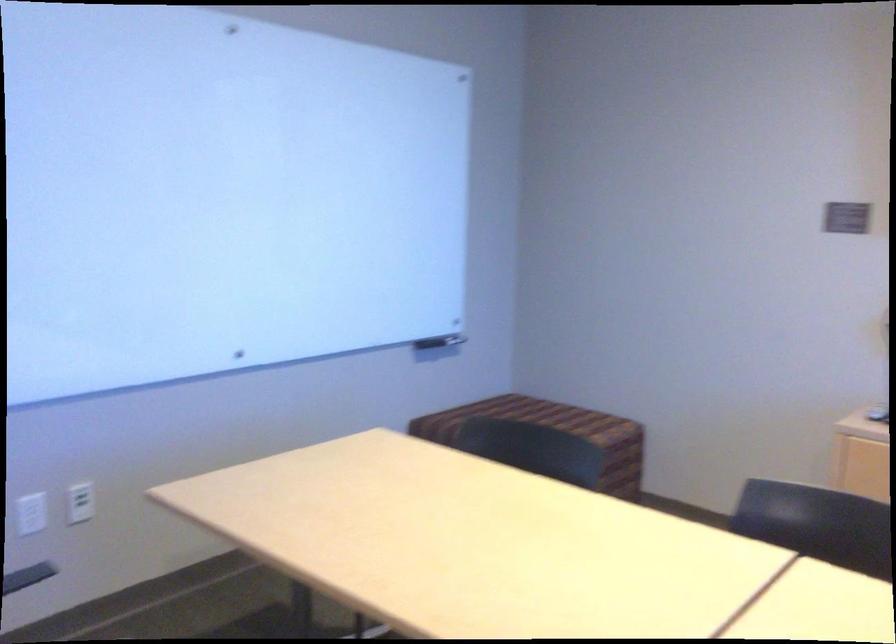
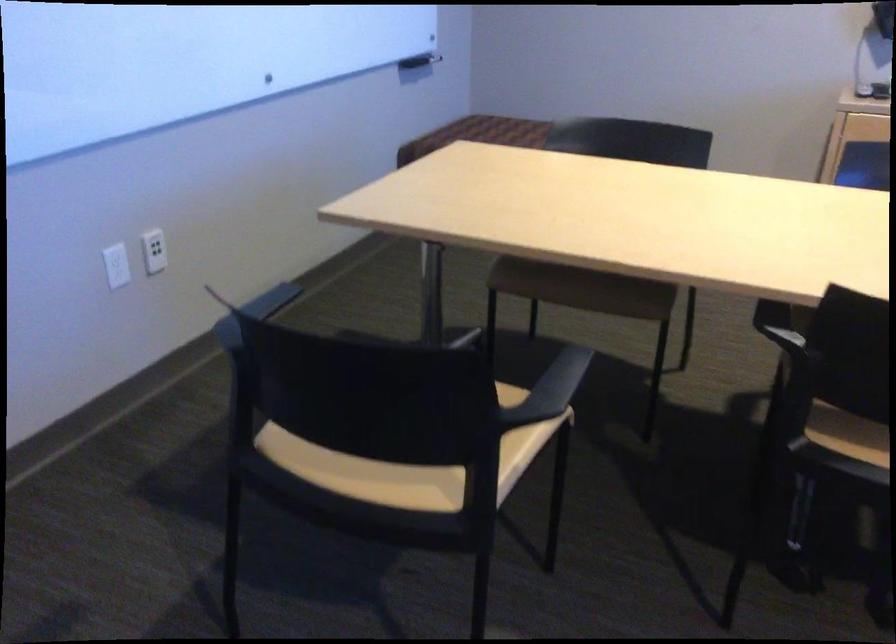
Question: What movement of the cameraman would produce the second image?

Choices:
 (A) Left
 (B) Right
 (C) Forward
 (D) Backward

Answer: (A)